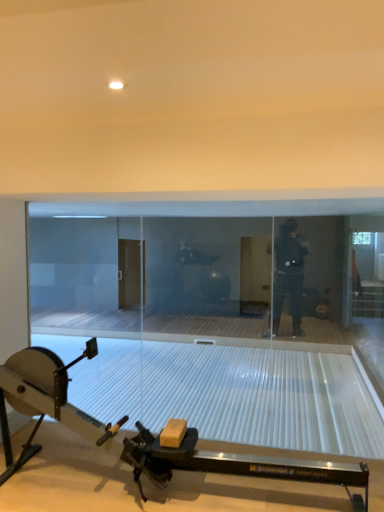
Question: From a real-world perspective, is transparent glass door at center positioned above or below metallic rowing machine at lower center?

Choices:
 (A) below
 (B) above

Answer: (A)

Question: In the image, is transparent glass door at center positioned in front of or behind metallic rowing machine at lower center?

Choices:
 (A) front
 (B) behind

Answer: (B)

Question: From the image's perspective, relative to metallic rowing machine at lower center, is transparent glass door at center above or below?

Choices:
 (A) above
 (B) below

Answer: (A)

Question: From a real-world perspective, is metallic rowing machine at lower center above or below transparent glass door at center?

Choices:
 (A) below
 (B) above

Answer: (B)

Question: Considering the positions of point (258, 475) and point (362, 219), is point (258, 475) closer or farther from the camera than point (362, 219)?

Choices:
 (A) closer
 (B) farther

Answer: (A)

Question: Looking at their shapes, would you say metallic rowing machine at lower center is wider or thinner than transparent glass door at center?

Choices:
 (A) thin
 (B) wide

Answer: (B)

Question: Considering the positions of metallic rowing machine at lower center and transparent glass door at center in the image, is metallic rowing machine at lower center bigger or smaller than transparent glass door at center?

Choices:
 (A) big
 (B) small

Answer: (A)